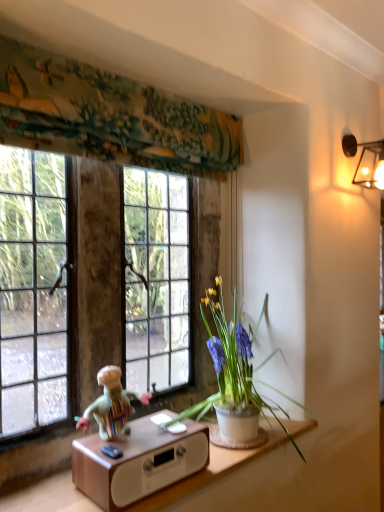
The height and width of the screenshot is (512, 384). Describe the element at coordinates (366, 161) in the screenshot. I see `metallic wall sconce at upper right` at that location.

Where is `textured fabric at upper center`? Image resolution: width=384 pixels, height=512 pixels. textured fabric at upper center is located at coordinates (110, 116).

In order to face textured fabric at upper center, should I rotate leftwards or rightwards?

A 6.297 degree turn to the left will do.

Locate an element on the screen. Image resolution: width=384 pixels, height=512 pixels. clear glass window at upper left is located at coordinates [x=32, y=301].

From a real-world perspective, relative to textured fabric at upper center, is multicolored fabric doll at lower center vertically above or below?

multicolored fabric doll at lower center is situated lower than textured fabric at upper center in the real world.

Between point (120, 380) and point (84, 129), which one is positioned in front?

The point (84, 129) is closer.

Is multicolored fabric doll at lower center closer to the viewer compared to textured fabric at upper center?

No, multicolored fabric doll at lower center is further to the viewer.

Is multicolored fabric doll at lower center touching textured fabric at upper center?

multicolored fabric doll at lower center and textured fabric at upper center are not in contact.

Image resolution: width=384 pixels, height=512 pixels. What are the coordinates of `window in front of the metallic wall sconce at upper right` in the screenshot? It's located at (32, 301).

Is clear glass window at upper left in front of metallic wall sconce at upper right?

Yes, it is.

Locate an element on the screen. This screenshot has height=512, width=384. person lying below the white ceramic pot at center (from the image's perspective) is located at coordinates (111, 405).

Between multicolored fabric doll at lower center and white ceramic pot at center, which one has smaller size?

multicolored fabric doll at lower center.

Which is more to the right, multicolored fabric doll at lower center or white ceramic pot at center?

From the viewer's perspective, white ceramic pot at center appears more on the right side.

Looking at this image, from the image's perspective, is multicolored fabric doll at lower center located above white ceramic pot at center?

No, from the image's perspective, multicolored fabric doll at lower center is not on top of white ceramic pot at center.

Which of these two, textured fabric at upper center or multicolored fabric doll at lower center, is bigger?

With larger size is textured fabric at upper center.

Considering the positions of points (41, 87) and (120, 374), is point (41, 87) closer to camera compared to point (120, 374)?

That is True.

Considering the sizes of textured fabric at upper center and multicolored fabric doll at lower center in the image, is textured fabric at upper center wider or thinner than multicolored fabric doll at lower center?

Clearly, textured fabric at upper center has more width compared to multicolored fabric doll at lower center.

Where is `curtain on the right of multicolored fabric doll at lower center`? The height and width of the screenshot is (512, 384). curtain on the right of multicolored fabric doll at lower center is located at coordinates (110, 116).

Is textured fabric at upper center turned away from metallic wall sconce at upper right?

No, metallic wall sconce at upper right is not at the back of textured fabric at upper center.

Does textured fabric at upper center have a larger size compared to metallic wall sconce at upper right?

Indeed, textured fabric at upper center has a larger size compared to metallic wall sconce at upper right.

Can you confirm if textured fabric at upper center is taller than metallic wall sconce at upper right?

Yes.

Is white ceramic pot at center looking in the opposite direction of clear glass window at upper left?

Yes, white ceramic pot at center is positioned with its back facing clear glass window at upper left.

Which of these two, white ceramic pot at center or clear glass window at upper left, is thinner?

clear glass window at upper left.

The width and height of the screenshot is (384, 512). What are the coordinates of `window that appears above the white ceramic pot at center (from the image's perspective)` in the screenshot? It's located at (32, 301).

Between clear glass window at upper left and white ceramic pot at center, which one has larger width?

white ceramic pot at center is wider.

Between clear glass window at upper left and white ceramic pot at center, which one is positioned behind?

clear glass window at upper left.

From the image's perspective, which is above, clear glass window at upper left or white ceramic pot at center?

clear glass window at upper left is shown above in the image.

This screenshot has width=384, height=512. I want to click on curtain that is in front of the multicolored fabric doll at lower center, so click(x=110, y=116).

I want to click on lamp above the clear glass window at upper left (from the image's perspective), so click(x=366, y=161).

From the image, which object appears to be farther from clear glass window at upper left, white ceramic pot at center or wooden table at lower center?

wooden table at lower center.

Based on their spatial positions, is wooden table at lower center or clear glass window at upper left further from metallic wall sconce at upper right?

wooden table at lower center is positioned further to the anchor metallic wall sconce at upper right.

Considering their positions, is white ceramic pot at center positioned closer to multicolored fabric doll at lower center than textured fabric at upper center?

Among the two, white ceramic pot at center is located nearer to multicolored fabric doll at lower center.

Based on their spatial positions, is textured fabric at upper center or metallic wall sconce at upper right further from wooden table at lower center?

Based on the image, metallic wall sconce at upper right appears to be further to wooden table at lower center.

Estimate the real-world distances between objects in this image. Which object is closer to clear glass window at upper left, metallic wall sconce at upper right or multicolored fabric doll at lower center?

multicolored fabric doll at lower center is positioned closer to the anchor clear glass window at upper left.

Which object lies nearer to the anchor point wooden table at lower center, multicolored fabric doll at lower center or white ceramic pot at center?

multicolored fabric doll at lower center is positioned closer to the anchor wooden table at lower center.

Which object lies nearer to the anchor point clear glass window at upper left, textured fabric at upper center or metallic wall sconce at upper right?

Among the two, textured fabric at upper center is located nearer to clear glass window at upper left.

Based on their spatial positions, is metallic wall sconce at upper right or textured fabric at upper center further from wooden table at lower center?

metallic wall sconce at upper right lies further to wooden table at lower center than the other object.

Locate an element on the screen. The width and height of the screenshot is (384, 512). curtain between multicolored fabric doll at lower center and metallic wall sconce at upper right from left to right is located at coordinates (110, 116).

You are a GUI agent. You are given a task and a screenshot of the screen. Output one action in this format:
    pyautogui.click(x=<x>, y=<y>)
    Task: Click on the lamp between textured fabric at upper center and wooden table at lower center in the up-down direction
    Image resolution: width=384 pixels, height=512 pixels.
    Given the screenshot: What is the action you would take?
    point(366,161)

This screenshot has width=384, height=512. Find the location of `window between multicolored fabric doll at lower center and white ceramic pot at center from left to right`. window between multicolored fabric doll at lower center and white ceramic pot at center from left to right is located at coordinates (32, 301).

The width and height of the screenshot is (384, 512). I want to click on lamp between textured fabric at upper center and white ceramic pot at center from top to bottom, so click(x=366, y=161).